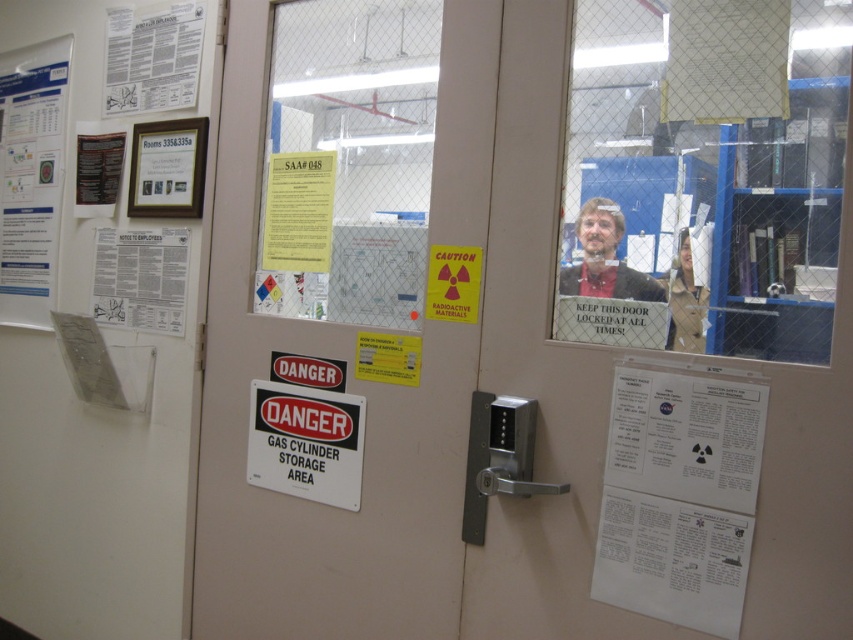
You are standing in front of the door and need to read the white paper poster at left and the matte black frame at upper left. Which one is located lower?

The white paper poster at left is positioned under the matte black frame at upper left, so the white paper poster at left is located lower.